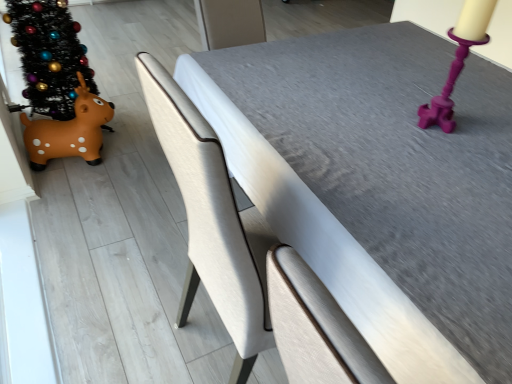
Question: Choose the correct answer: Is brown rubber toy at left inside black glittery christmas tree at left or outside it?

Choices:
 (A) inside
 (B) outside

Answer: (B)

Question: Is brown rubber toy at left taller or shorter than black glittery christmas tree at left?

Choices:
 (A) tall
 (B) short

Answer: (B)

Question: Which object is the farthest from the black glittery christmas tree at left?

Choices:
 (A) brown rubber toy at left
 (B) purple plastic candle holder at upper right
 (C) textured gray table at center

Answer: (B)

Question: Which object is the closest to the purple plastic candle holder at upper right?

Choices:
 (A) black glittery christmas tree at left
 (B) textured gray table at center
 (C) brown rubber toy at left

Answer: (B)